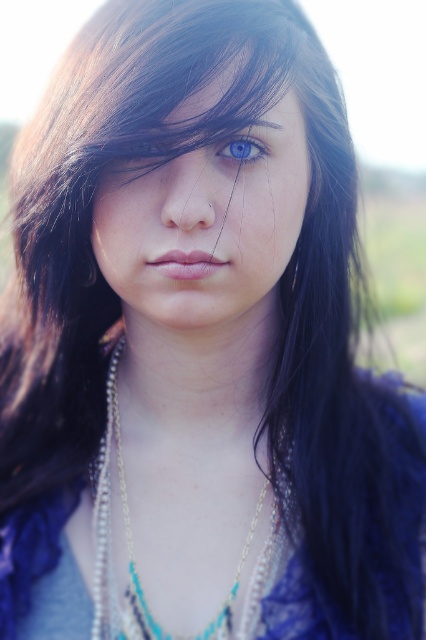
Is blue matte eye at center behind dark brown eyebrow at upper center?

No, it is in front of dark brown eyebrow at upper center.

Between point (143, 140) and point (270, 125), which one is positioned in front?

Point (143, 140) is more forward.

Is point (129, 147) less distant than point (270, 108)?

Yes, it is in front of point (270, 108).

In order to click on blue matte eye at center in this screenshot , I will do (x=146, y=145).

This screenshot has width=426, height=640. Describe the element at coordinates (242, 148) in the screenshot. I see `blue glossy eye at upper center` at that location.

From the picture: Who is positioned more to the right, blue glossy eye at upper center or dark brown eyebrow at upper center?

dark brown eyebrow at upper center is more to the right.

Who is more forward, (236, 136) or (244, 125)?

Point (244, 125)

Where is `blue glossy eye at upper center`? Image resolution: width=426 pixels, height=640 pixels. blue glossy eye at upper center is located at coordinates (242, 148).

Who is higher up, pearl/beaded necklace at center or blue matte eye at center?

blue matte eye at center

Measure the distance from pearl/beaded necklace at center to blue matte eye at center.

pearl/beaded necklace at center is 30.85 centimeters away from blue matte eye at center.

Measure the distance between pearl/beaded necklace at center and camera.

pearl/beaded necklace at center and camera are 23.37 inches apart from each other.

The width and height of the screenshot is (426, 640). Identify the location of pearl/beaded necklace at center. (109, 538).